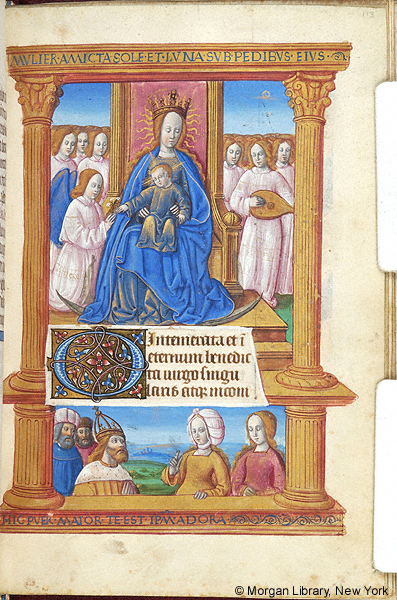
The height and width of the screenshot is (600, 397). In order to click on throne in this screenshot , I will do `click(218, 244)`.